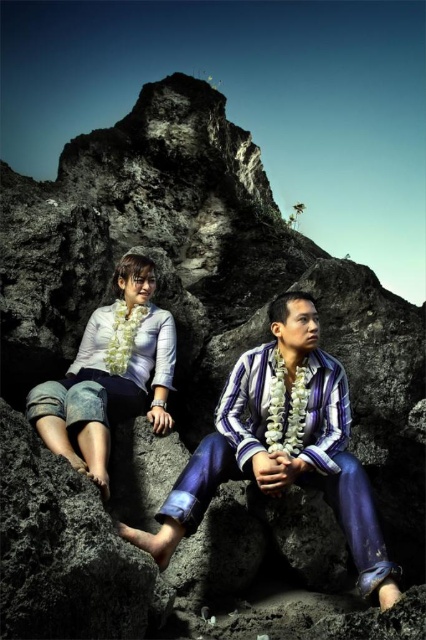
Question: Is smooth rock at lower center above denim shorts at left?

Choices:
 (A) yes
 (B) no

Answer: (B)

Question: Does striped cotton shirt at center appear under smooth rock at lower center?

Choices:
 (A) no
 (B) yes

Answer: (A)

Question: Among these objects, which one is farthest from the camera?

Choices:
 (A) striped cotton shirt at center
 (B) denim shorts at left

Answer: (B)

Question: Does striped cotton shirt at center have a larger size compared to smooth rock at lower center?

Choices:
 (A) no
 (B) yes

Answer: (B)

Question: Which point is farther to the camera?

Choices:
 (A) striped cotton shirt at center
 (B) smooth rock at lower center

Answer: (A)

Question: Which of the following is the closest to the observer?

Choices:
 (A) smooth rock at lower center
 (B) striped cotton shirt at center
 (C) denim shorts at left

Answer: (A)